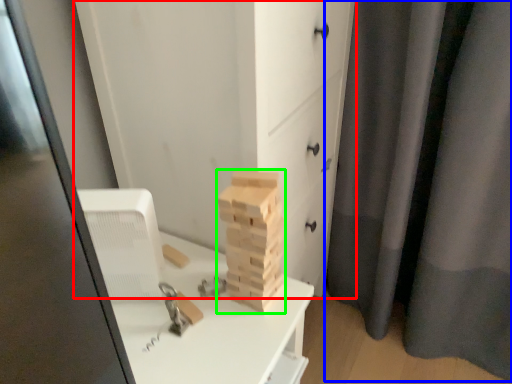
Question: Considering the real-world distances, which object is closest to chest of drawers (highlighted by a red box)? curtain (highlighted by a blue box) or drawer (highlighted by a green box).

Choices:
 (A) curtain
 (B) drawer

Answer: (B)